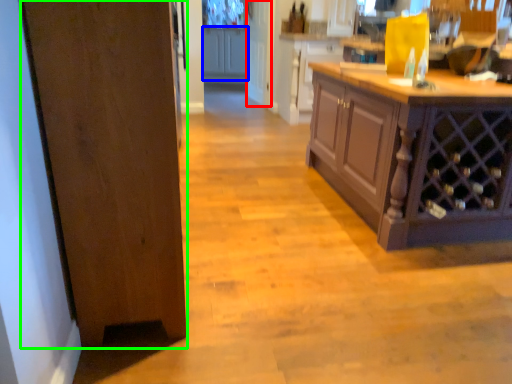
Question: Which object is the farthest from glass door (highlighted by a red box)? Choose among these: cabinetry (highlighted by a blue box) or door (highlighted by a green box).

Choices:
 (A) cabinetry
 (B) door

Answer: (B)